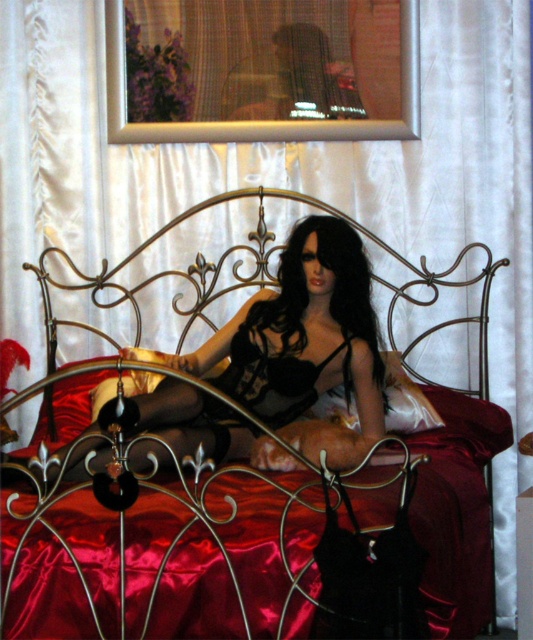
Question: Is satin black lingerie at center to the right of metallic gold bed at center from the viewer's perspective?

Choices:
 (A) yes
 (B) no

Answer: (B)

Question: Among these points, which one is farthest from the camera?

Choices:
 (A) (279, 465)
 (B) (484, 305)
 (C) (197, 314)

Answer: (C)

Question: From the image, what is the correct spatial relationship of satin black lingerie at center in relation to gold wrought iron headboard at center?

Choices:
 (A) above
 (B) below

Answer: (B)

Question: Does satin black lingerie at center lie behind metallic gold bed at center?

Choices:
 (A) no
 (B) yes

Answer: (A)

Question: Which object appears farthest from the camera in this image?

Choices:
 (A) metallic gold bed at center
 (B) satin black lingerie at center

Answer: (A)

Question: Which object is positioned farthest from the metallic gold bed at center?

Choices:
 (A) satin black lingerie at center
 (B) gold wrought iron headboard at center

Answer: (A)